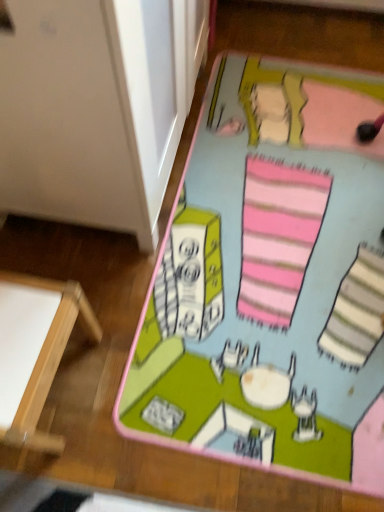
Where is `vacant area located to the right-hand side of white wood table at lower left`? vacant area located to the right-hand side of white wood table at lower left is located at coordinates (146, 381).